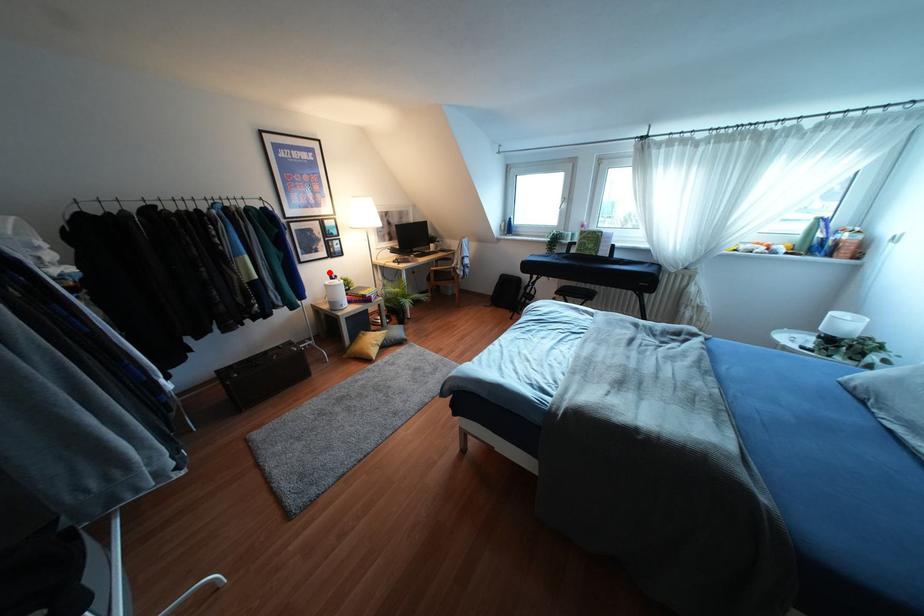
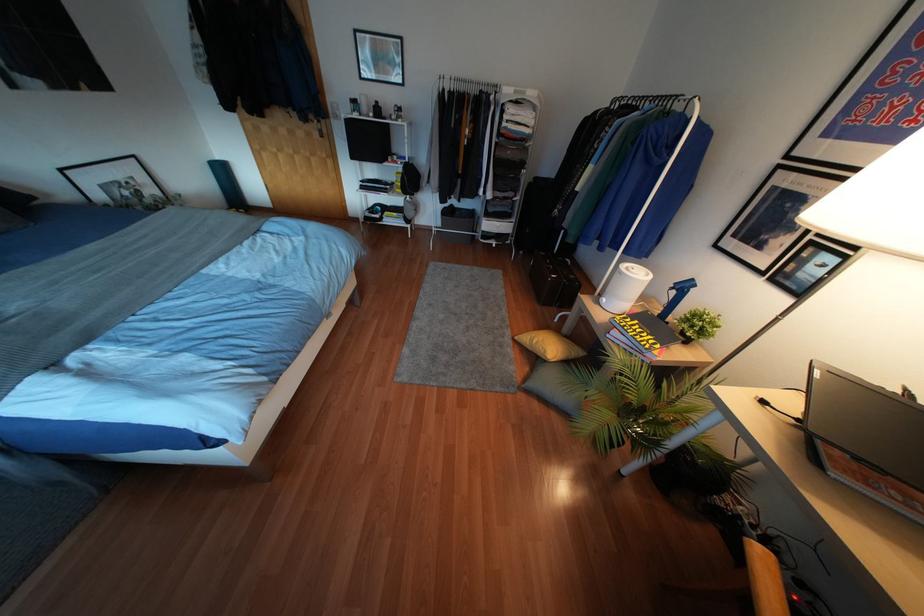
In the second image, find the point that corresponds to the highlighted location in the first image.

(690, 280)